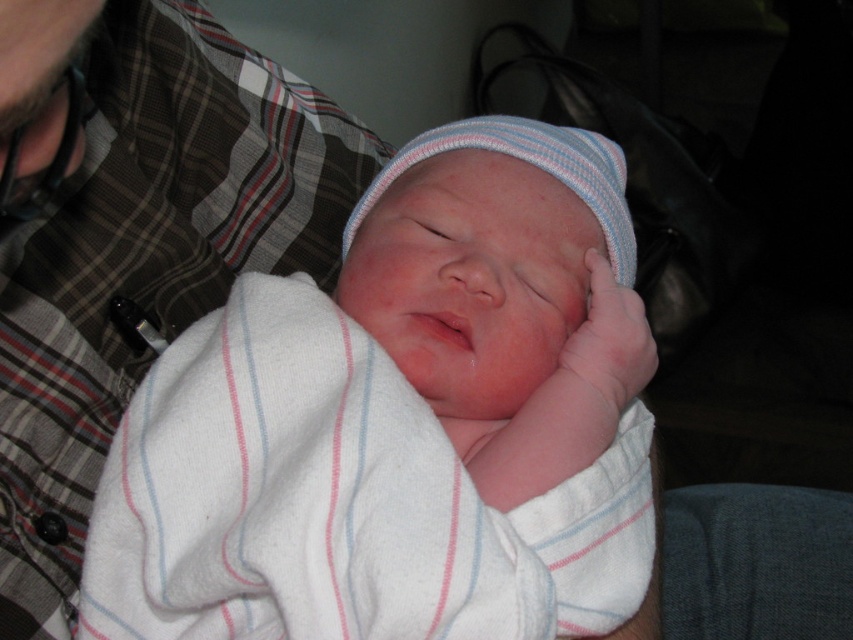
Can you confirm if white striped blanket at center is shorter than pink soft fabric hand at center?

No.

In the scene shown: Which of these two, white striped blanket at center or pink soft fabric hand at center, stands taller?

white striped blanket at center

Does point (477, 173) come farther from viewer compared to point (560, 380)?

Yes, it is behind point (560, 380).

At what (x,y) coordinates should I click in order to perform the action: click on white striped blanket at center. Please return your answer as a coordinate pair (x, y). Looking at the image, I should click on (402, 420).